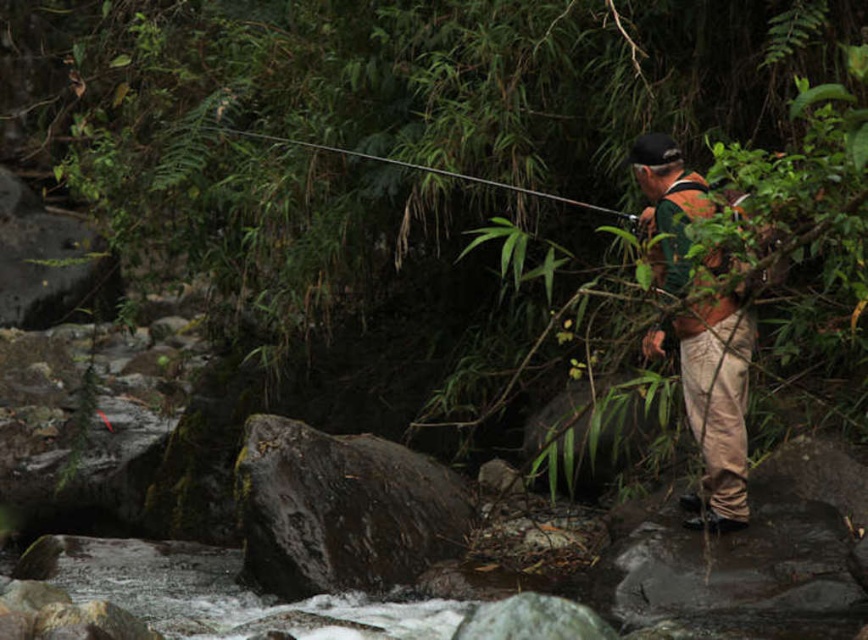
Is dark brown rough rock at center behind smooth black rod at upper center?

That is True.

Image resolution: width=868 pixels, height=640 pixels. What do you see at coordinates (340, 509) in the screenshot?
I see `dark brown rough rock at center` at bounding box center [340, 509].

You are a GUI agent. You are given a task and a screenshot of the screen. Output one action in this format:
    pyautogui.click(x=<x>, y=<y>)
    Task: Click on the dark brown rough rock at center
    This screenshot has height=640, width=868.
    Given the screenshot: What is the action you would take?
    pyautogui.click(x=340, y=509)

Does green fabric shirt at right have a lesser width compared to smooth black rod at upper center?

Yes, green fabric shirt at right is thinner than smooth black rod at upper center.

Is point (698, 358) positioned behind point (349, 150)?

No.

The height and width of the screenshot is (640, 868). What are the coordinates of `green fabric shirt at right` in the screenshot? It's located at (715, 404).

Between dark brown rough rock at center and green fabric shirt at right, which one has less height?

With less height is dark brown rough rock at center.

Between point (327, 481) and point (661, 170), which one is positioned in front?

Point (661, 170) is in front.

Find the location of `dark brown rough rock at center`. dark brown rough rock at center is located at coordinates (340, 509).